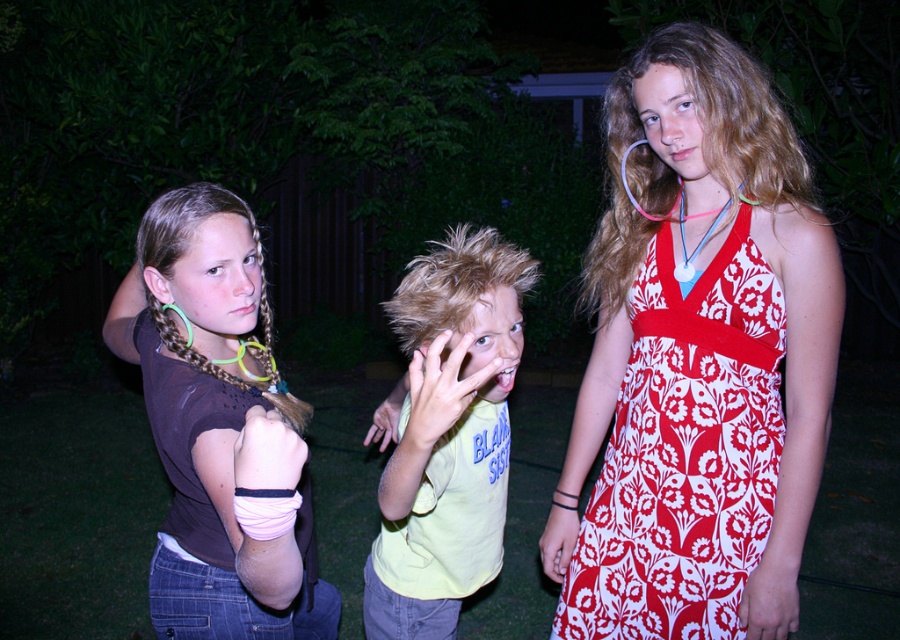
Is red floral-patterned dress at upper right above yellow cotton shirt at center?

Incorrect, red floral-patterned dress at upper right is not positioned above yellow cotton shirt at center.

Is red floral-patterned dress at upper right smaller than yellow cotton shirt at center?

Correct, red floral-patterned dress at upper right occupies less space than yellow cotton shirt at center.

What do you see at coordinates (684, 452) in the screenshot? I see `red floral-patterned dress at upper right` at bounding box center [684, 452].

What are the coordinates of `red floral-patterned dress at upper right` in the screenshot? It's located at (684, 452).

Which is more to the left, brown matte shirt at center or yellow cotton shirt at center?

From the viewer's perspective, brown matte shirt at center appears more on the left side.

Can you confirm if brown matte shirt at center is bigger than yellow cotton shirt at center?

Indeed, brown matte shirt at center has a larger size compared to yellow cotton shirt at center.

Is point (221, 461) farther from viewer compared to point (428, 548)?

No, it is not.

Identify the location of brown matte shirt at center. (222, 433).

Who is higher up, red floral-patterned dress at upper right or brown matte shirt at center?

Positioned higher is brown matte shirt at center.

Does red floral-patterned dress at upper right have a lesser height compared to brown matte shirt at center?

Yes.

Locate an element on the screen. The width and height of the screenshot is (900, 640). red floral-patterned dress at upper right is located at coordinates (684, 452).